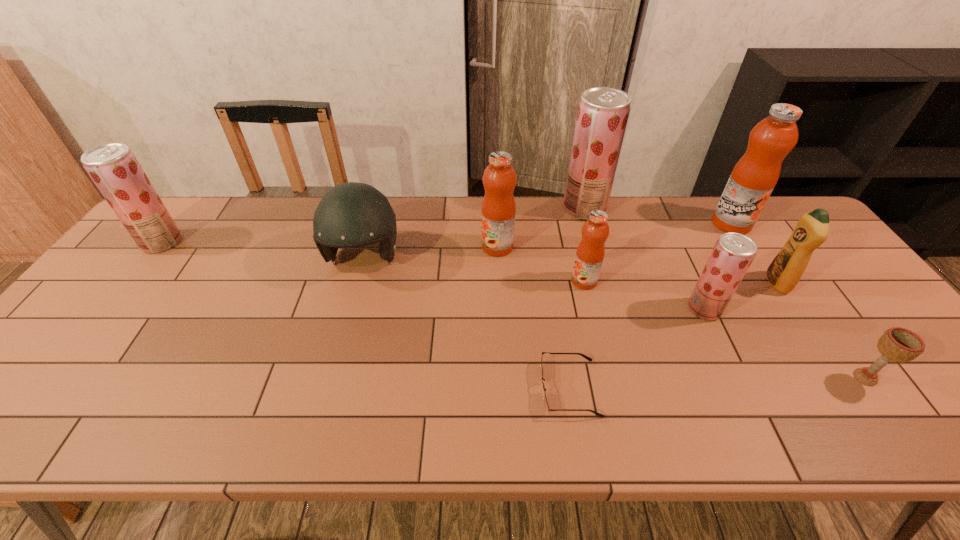
In order to click on blank space located 0.090m on the front label of the second nearest fruit juice in this screenshot , I will do `click(539, 281)`.

Identify the location of free space located 0.060m on the front label of the second nearest fruit juice. This screenshot has width=960, height=540. (549, 281).

Locate an element on the screen. vacant area situated 0.180m on the front label of the second nearest fruit juice is located at coordinates click(506, 281).

I want to click on vacant position located on the left of the chalice, so pos(810,377).

Find the location of a particular element. This screenshot has height=540, width=960. vacant space located 0.200m on the front-facing side of the black spectacles is located at coordinates (450, 388).

Where is `free space located 0.250m on the front-facing side of the black spectacles`? free space located 0.250m on the front-facing side of the black spectacles is located at coordinates (427, 388).

At what (x,y) coordinates should I click in order to perform the action: click on free space located on the front-facing side of the black spectacles. Please return your answer as a coordinate pair (x, y). Image resolution: width=960 pixels, height=540 pixels. Looking at the image, I should click on (392, 388).

Locate an element on the screen. football helmet situated at the far edge is located at coordinates (352, 214).

Find the location of a particular element. object located at the near edge is located at coordinates (546, 405).

Image resolution: width=960 pixels, height=540 pixels. Find the location of `object present at the left edge`. object present at the left edge is located at coordinates (113, 167).